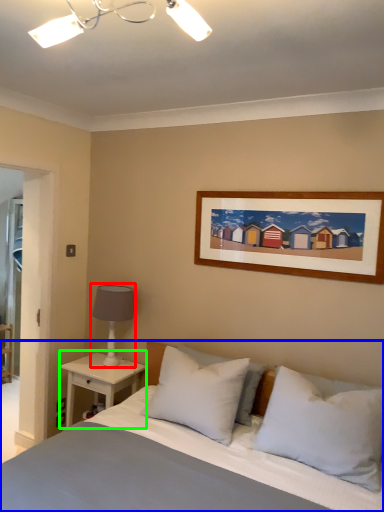
Question: Based on their relative distances, which object is farther from table lamp (highlighted by a red box)? Choose from bed (highlighted by a blue box) and nightstand (highlighted by a green box).

Choices:
 (A) bed
 (B) nightstand

Answer: (A)